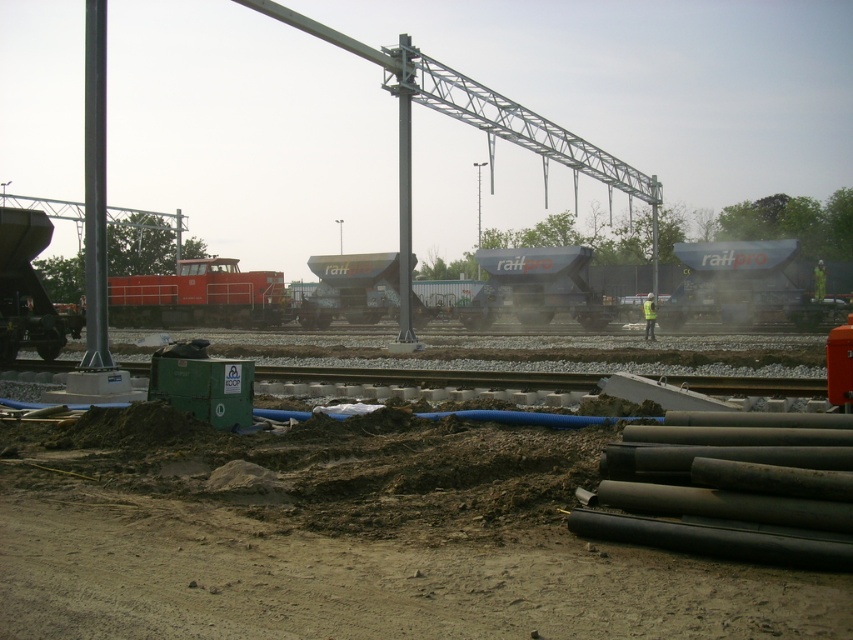
Question: Which point is farther to the camera?

Choices:
 (A) yellow reflective vest at center
 (B) smooth metallic pole at left
 (C) metallic gray pole at center

Answer: (A)

Question: Which point appears farthest from the camera in this image?

Choices:
 (A) (142, 529)
 (B) (409, 268)
 (C) (648, 330)
 (D) (96, 58)

Answer: (C)

Question: Which of the following is the closest to the observer?

Choices:
 (A) (403, 161)
 (B) (96, 38)
 (C) (421, 451)

Answer: (C)

Question: Can you confirm if smooth metallic pole at left is positioned above yellow reflective vest at center?

Choices:
 (A) yes
 (B) no

Answer: (A)

Question: Considering the relative positions of smooth metallic pole at left and yellow reflective vest at center in the image provided, where is smooth metallic pole at left located with respect to yellow reflective vest at center?

Choices:
 (A) right
 (B) left

Answer: (B)

Question: Can you confirm if smooth metallic pole at left is positioned to the right of yellow reflective vest at center?

Choices:
 (A) yes
 (B) no

Answer: (B)